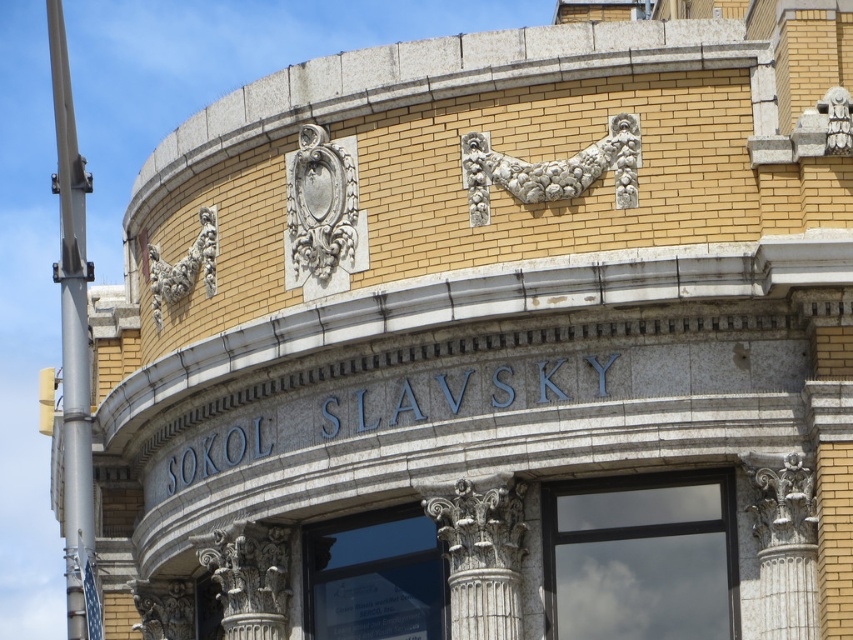
You are an architect examining the building facade. You notice the white stone ornament at center and the carved stone ornament at upper left. Which one is placed higher on the building?

The white stone ornament at center is positioned over the carved stone ornament at upper left, meaning it is higher up on the building.

You are standing in front of the building and want to touch the white stone ornament at center and the carved stone ornament at upper left. Which one would you need to reach out further to touch?

You would need to reach out further to touch the carved stone ornament at upper left because it is farther from you compared to the white stone ornament at center, which is closer.

You are an architect planning to install a new lighting fixture between the white marble column at center and the carved stone column at lower left. The fixture requires a minimum of 40 feet of space between the two columns to be safely installed. Based on the scene description, can the lighting fixture be installed between these two columns?

The distance between the white marble column at center and the carved stone column at lower left is 42.17 feet, which exceeds the required 40 feet. Therefore, the lighting fixture can be safely installed between them.